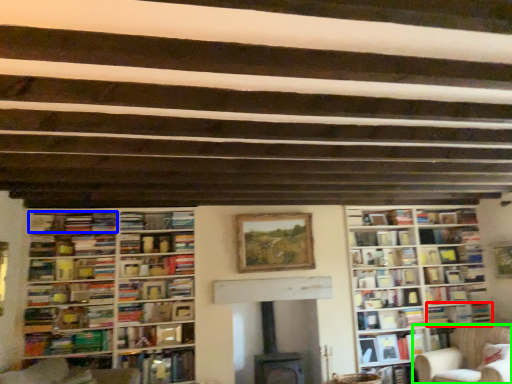
Question: Which is farther away from book (highlighted by a red box)? book (highlighted by a blue box) or chair (highlighted by a green box)?

Choices:
 (A) book
 (B) chair

Answer: (A)